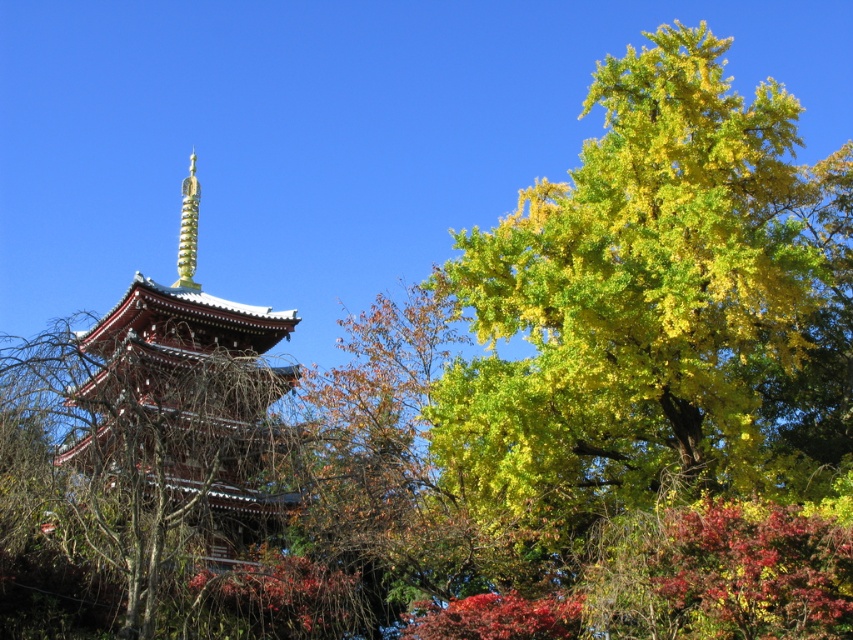
Does point (146, 608) lie behind point (195, 186)?

No, it is in front of (195, 186).

Can you confirm if matte red pagoda at center is bigger than gold textured spire at upper center?

Yes.

Find the location of a particular element. This screenshot has width=853, height=640. matte red pagoda at center is located at coordinates (175, 435).